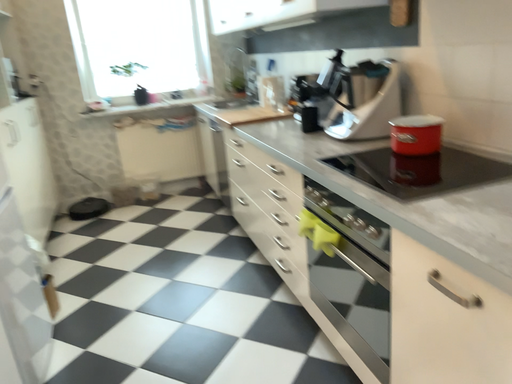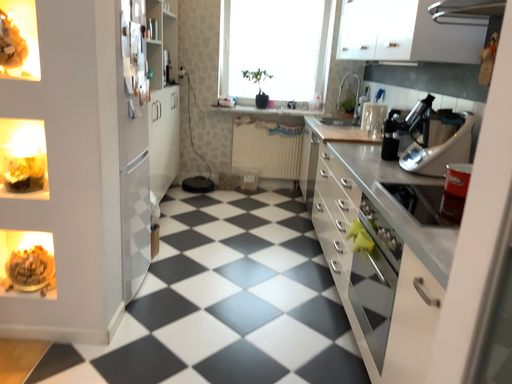
Question: Which way did the camera rotate in the video?

Choices:
 (A) rotated right
 (B) rotated left

Answer: (B)